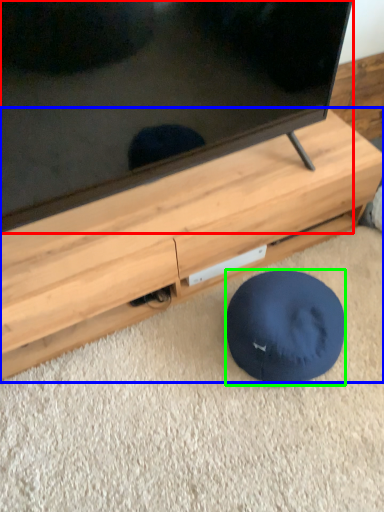
Question: Based on their relative distances, which object is farther from television (highlighted by a red box)? Choose from furniture (highlighted by a blue box) and dog bed (highlighted by a green box).

Choices:
 (A) furniture
 (B) dog bed

Answer: (B)